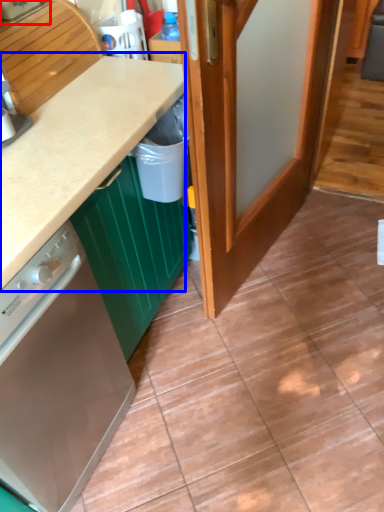
Question: Which point is closer to the camera, kitchen appliance (highlighted by a red box) or countertop (highlighted by a blue box)?

Choices:
 (A) kitchen appliance
 (B) countertop

Answer: (B)